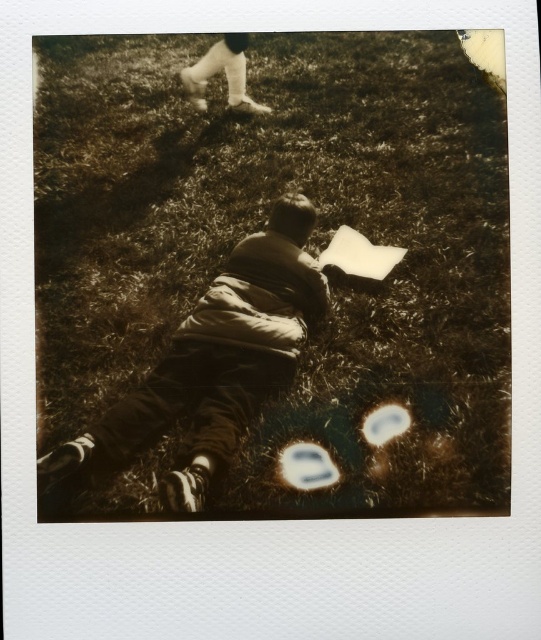
Is brown cotton shirt at center bigger than white fabric pants at upper center?

Indeed, brown cotton shirt at center has a larger size compared to white fabric pants at upper center.

Does brown cotton shirt at center have a greater height compared to white fabric pants at upper center?

Yes.

Is point (49, 481) farther from camera compared to point (235, 58)?

No, it is in front of (235, 58).

You are a GUI agent. You are given a task and a screenshot of the screen. Output one action in this format:
    pyautogui.click(x=<x>, y=<y>)
    Task: Click on the brown cotton shirt at center
    This screenshot has width=541, height=640.
    Given the screenshot: What is the action you would take?
    pyautogui.click(x=209, y=368)

Does brown grass at center have a greater width compared to brown cotton shirt at center?

No, brown grass at center is not wider than brown cotton shirt at center.

Who is more forward, (345,378) or (194,504)?

Point (194,504)

Between point (413, 419) and point (50, 499), which one is positioned behind?

Positioned behind is point (413, 419).

Where is `brown grass at center`? brown grass at center is located at coordinates (273, 275).

Is brown grass at center positioned behind white fabric pants at upper center?

No, it is in front of white fabric pants at upper center.

Can you confirm if brown grass at center is taller than white fabric pants at upper center?

Incorrect, brown grass at center's height is not larger of white fabric pants at upper center's.

Identify the location of brown grass at center. (273, 275).